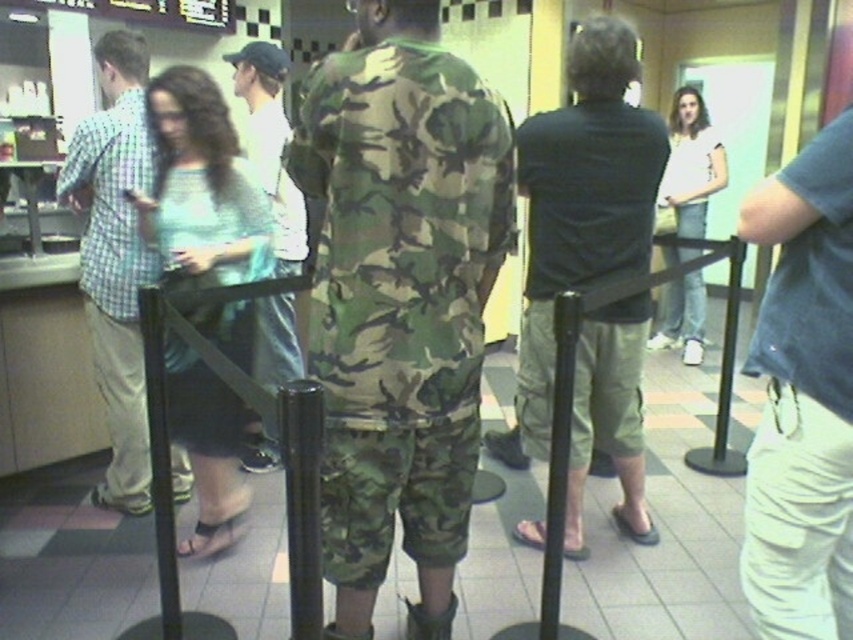
You are a delivery person who needs to quickly pass through the line to deliver a package. The light blue fabric dress at center and the black plastic pole at center are in your path. Can you navigate between them without touching either?

The light blue fabric dress at center and the black plastic pole at center are 15.82 inches apart from each other. Since 15.82 inches is approximately 40 cm, there is sufficient space for a person to pass through without touching either object.